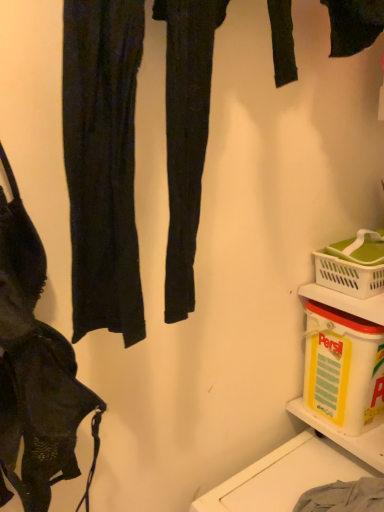
Question: Does gray cotton towel at lower right contain matte black bra at left?

Choices:
 (A) no
 (B) yes

Answer: (A)

Question: Can you confirm if gray cotton towel at lower right is thinner than matte black bra at left?

Choices:
 (A) no
 (B) yes

Answer: (A)

Question: Considering the relative positions of gray cotton towel at lower right and matte black bra at left in the image provided, is gray cotton towel at lower right to the left of matte black bra at left from the viewer's perspective?

Choices:
 (A) yes
 (B) no

Answer: (B)

Question: Is gray cotton towel at lower right aimed at matte black bra at left?

Choices:
 (A) no
 (B) yes

Answer: (A)

Question: Is gray cotton towel at lower right located outside matte black bra at left?

Choices:
 (A) yes
 (B) no

Answer: (A)

Question: Is point (44, 435) closer or farther from the camera than point (344, 329)?

Choices:
 (A) closer
 (B) farther

Answer: (A)

Question: From their relative heights in the image, would you say matte black bra at left is taller or shorter than yellow plastic container at lower right?

Choices:
 (A) short
 (B) tall

Answer: (B)

Question: In terms of width, does matte black bra at left look wider or thinner when compared to yellow plastic container at lower right?

Choices:
 (A) thin
 (B) wide

Answer: (A)

Question: From a real-world perspective, is matte black bra at left positioned above or below yellow plastic container at lower right?

Choices:
 (A) below
 (B) above

Answer: (B)

Question: Is yellow plastic container at lower right in front of or behind white plastic container at lower right in the image?

Choices:
 (A) front
 (B) behind

Answer: (A)

Question: Considering the positions of yellow plastic container at lower right and white plastic container at lower right in the image, is yellow plastic container at lower right wider or thinner than white plastic container at lower right?

Choices:
 (A) thin
 (B) wide

Answer: (A)

Question: In terms of height, does yellow plastic container at lower right look taller or shorter compared to white plastic container at lower right?

Choices:
 (A) tall
 (B) short

Answer: (A)

Question: Do you think yellow plastic container at lower right is within white plastic container at lower right, or outside of it?

Choices:
 (A) inside
 (B) outside

Answer: (B)

Question: Considering the positions of white plastic picnic basket at lower right and gray cotton towel at lower right in the image, is white plastic picnic basket at lower right bigger or smaller than gray cotton towel at lower right?

Choices:
 (A) small
 (B) big

Answer: (B)

Question: Considering their positions, is white plastic picnic basket at lower right located in front of or behind gray cotton towel at lower right?

Choices:
 (A) front
 (B) behind

Answer: (B)